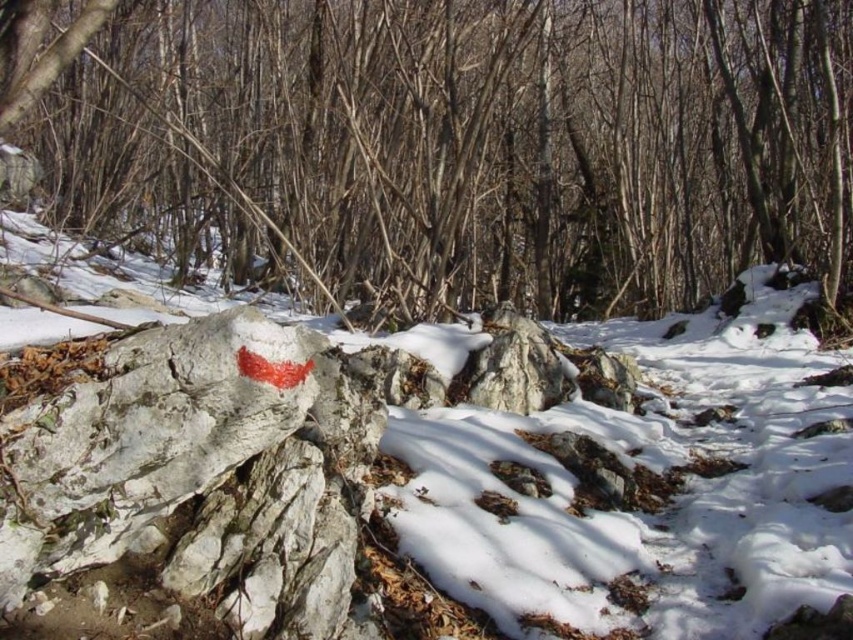
Looking at this image, which is more to the right, white matte rock at center or speckled gray rock at center?

Positioned to the right is white matte rock at center.

Is point (62, 509) in front of point (468, 387)?

Yes, point (62, 509) is closer to viewer.

Image resolution: width=853 pixels, height=640 pixels. What are the coordinates of `white matte rock at center` in the screenshot? It's located at (430, 484).

Does smooth bark tree at center come in front of white matte rock at center?

No.

Is point (84, 106) positioned in front of point (335, 451)?

No, (84, 106) is behind (335, 451).

The height and width of the screenshot is (640, 853). Describe the element at coordinates (447, 144) in the screenshot. I see `smooth bark tree at center` at that location.

This screenshot has width=853, height=640. In order to click on smooth bark tree at center in this screenshot , I will do `click(447, 144)`.

Which is more to the right, white matte rock at center or white rough rock at center?

From the viewer's perspective, white matte rock at center appears more on the right side.

Can you confirm if white matte rock at center is bigger than white rough rock at center?

Yes.

Who is more distant from viewer, (177, 390) or (252, 620)?

The point (252, 620) is behind.

Locate an element on the screen. white matte rock at center is located at coordinates [430, 484].